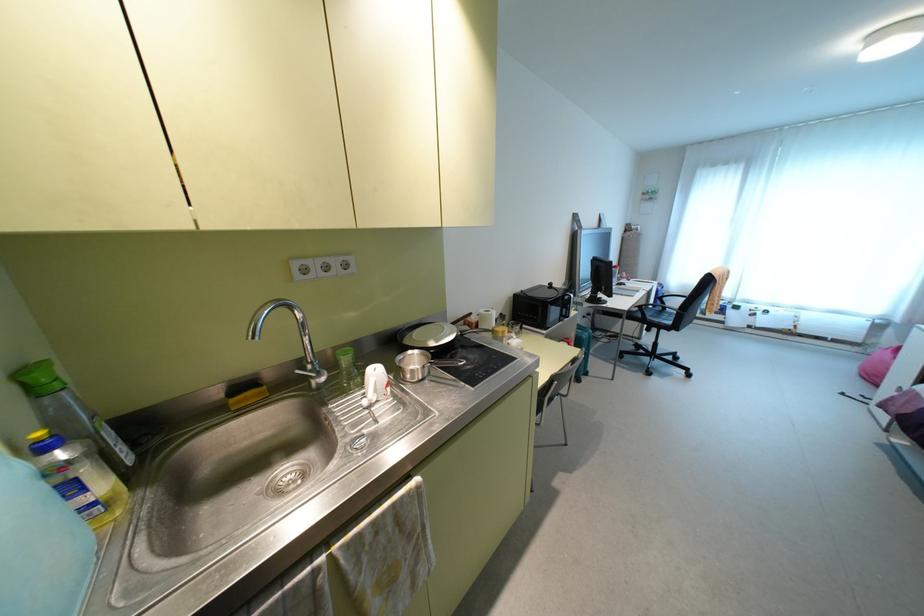
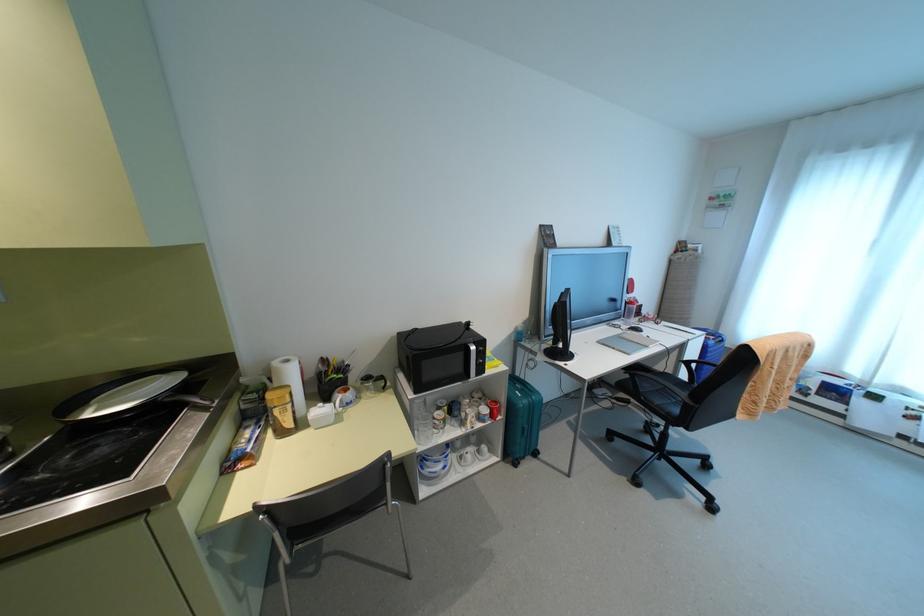
In a continuous first-person perspective shot, in which direction is the camera moving?

The cameraman walked toward right, forward.